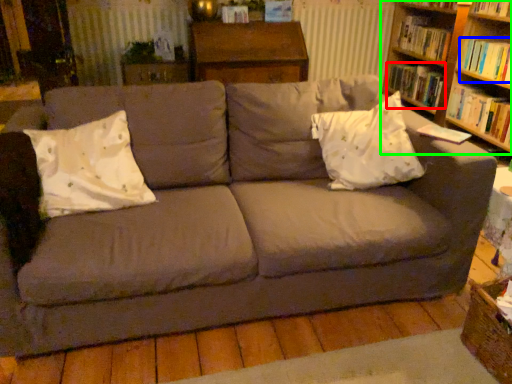
Question: Which object is positioned farthest from book (highlighted by a red box)? Select from book (highlighted by a blue box) and bookcase (highlighted by a green box).

Choices:
 (A) book
 (B) bookcase

Answer: (A)